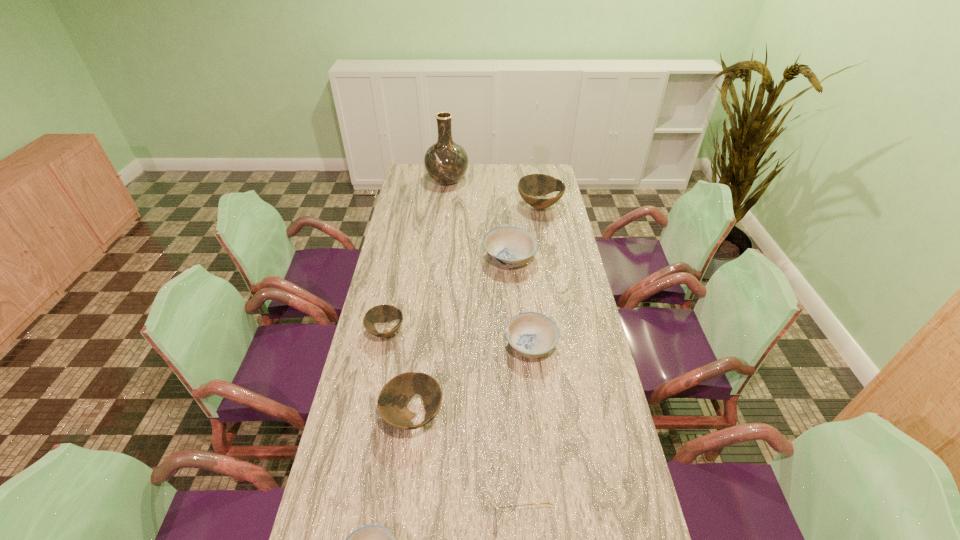
Where is `the farthest object`? This screenshot has height=540, width=960. the farthest object is located at coordinates click(x=446, y=162).

I want to click on vase, so click(446, 162).

Locate an element on the screen. the seventh shortest object is located at coordinates (534, 185).

Identify the location of the seventh nearest object. The width and height of the screenshot is (960, 540). (534, 185).

Identify the location of the sixth farthest object. This screenshot has width=960, height=540. (392, 402).

Locate an element on the screen. the second biggest brown bowl is located at coordinates (392, 402).

Locate an element on the screen. This screenshot has width=960, height=540. the farthest blue bowl is located at coordinates (508, 246).

What are the coordinates of `the fifth nearest bowl` in the screenshot? It's located at (508, 246).

The height and width of the screenshot is (540, 960). I want to click on the second biggest blue bowl, so click(531, 334).

Identify the location of the second nearest brown bowl. The width and height of the screenshot is (960, 540). (384, 313).